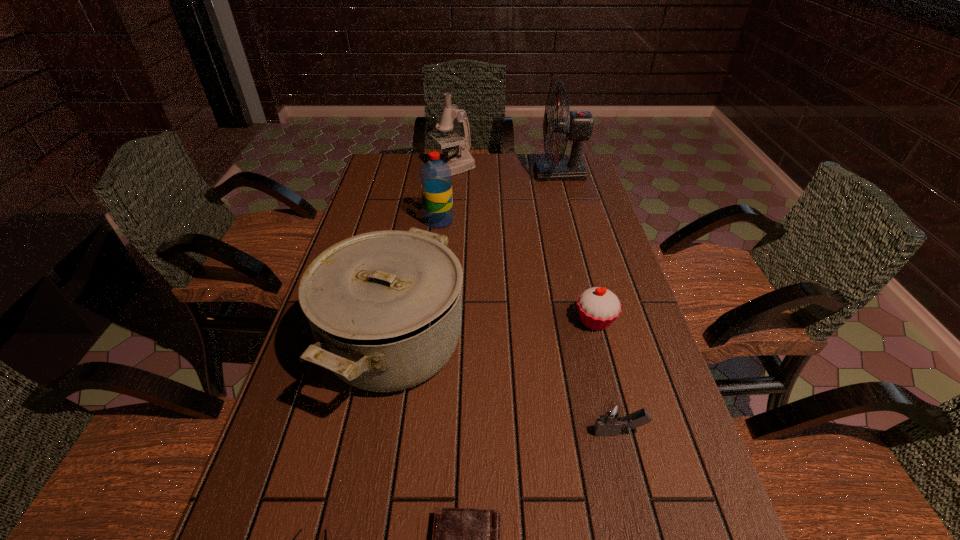
Find the location of a particular element. This screenshot has width=960, height=540. free location located 0.270m on the front label of the water bottle is located at coordinates (538, 221).

Where is `vacant area located 0.230m on the back of the saucepan`? The width and height of the screenshot is (960, 540). vacant area located 0.230m on the back of the saucepan is located at coordinates (415, 231).

Find the location of a particular element. blank space located on the left of the cupcake is located at coordinates (413, 321).

Locate an element on the screen. vacant space situated 0.110m on the front of the igniter is located at coordinates (637, 505).

At what (x,y) coordinates should I click in order to perform the action: click on fan that is at the far edge. Please return your answer as a coordinate pair (x, y). The image size is (960, 540). Looking at the image, I should click on (578, 125).

Identify the location of microscope that is at the far edge. (463, 161).

At what (x,y) coordinates should I click in order to perform the action: click on object that is at the left edge. Please return your answer as a coordinate pair (x, y). The width and height of the screenshot is (960, 540). Looking at the image, I should click on (385, 308).

Identify the location of fan that is at the right edge. (578, 125).

Find the location of a particular element. The width and height of the screenshot is (960, 540). cupcake at the right edge is located at coordinates (598, 307).

You are a GUI agent. You are given a task and a screenshot of the screen. Output one action in this format:
    pyautogui.click(x=<x>, y=<y>)
    Task: Click on the igniter at the right edge
    Image resolution: width=960 pixels, height=540 pixels.
    Given the screenshot: What is the action you would take?
    pyautogui.click(x=611, y=418)